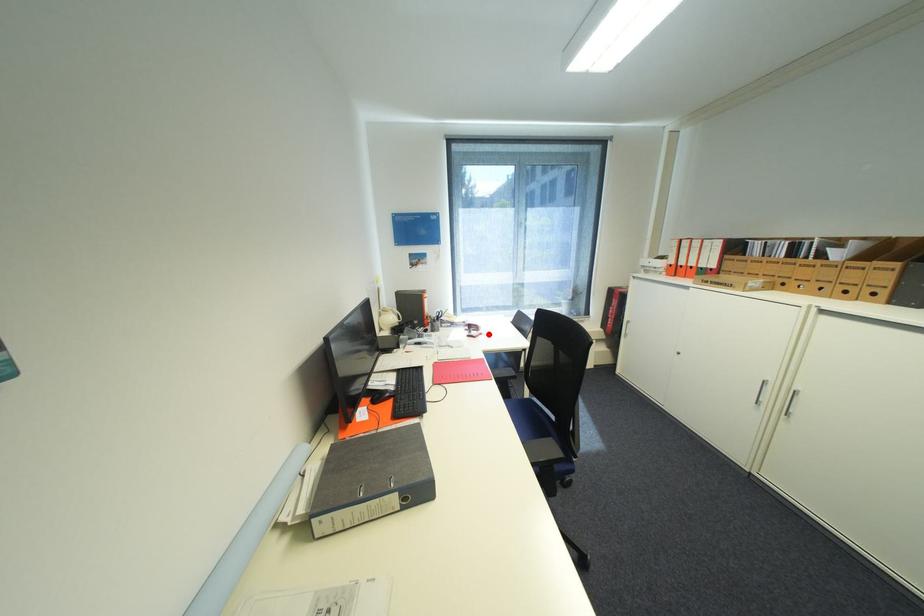
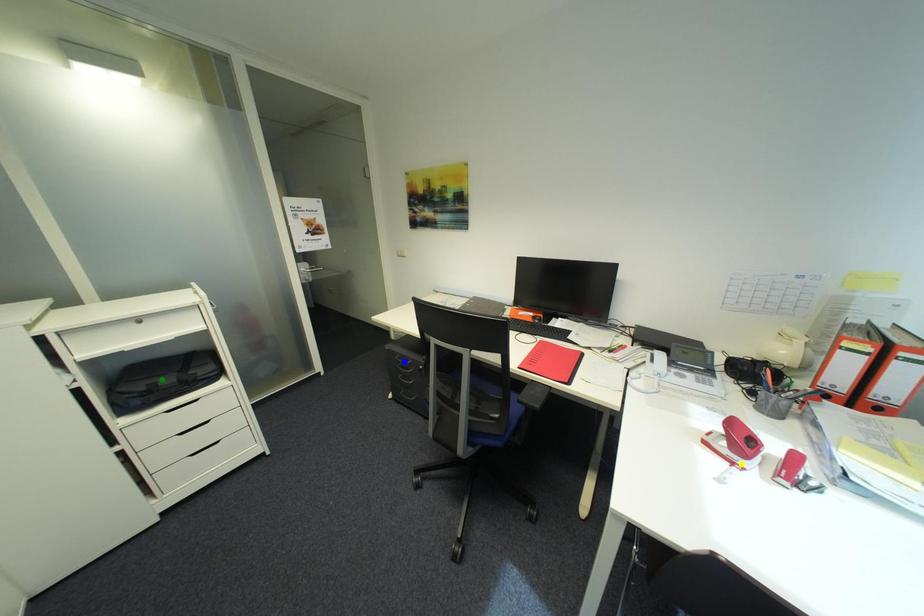
Question: I am providing you with two images of the same scene from different viewpoints. A red point is marked on the first image. You are given multiple points on the second image. Which point in image 2 is actually the same real-world point as the red point in image 1?

Choices:
 (A) yellow point
 (B) green point
 (C) blue point

Answer: (A)